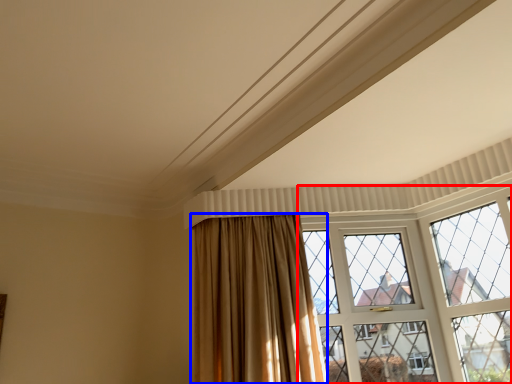
Question: Which object appears closest to the camera in this image, window (highlighted by a red box) or curtain (highlighted by a blue box)?

Choices:
 (A) window
 (B) curtain

Answer: (B)